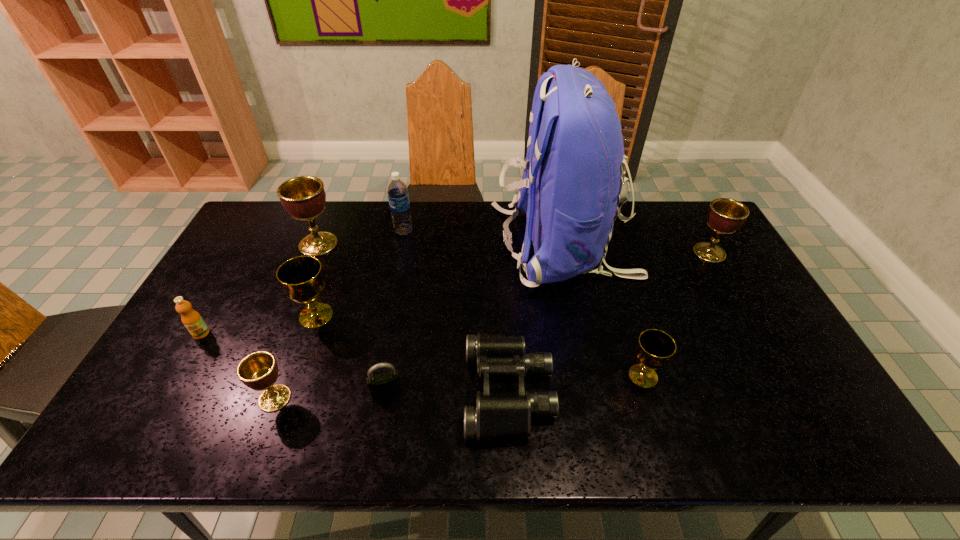
This screenshot has height=540, width=960. In order to click on chalice located in the far edge section of the desktop in this screenshot , I will do `click(303, 197)`.

You are a GUI agent. You are given a task and a screenshot of the screen. Output one action in this format:
    pyautogui.click(x=<x>, y=<y>)
    Task: Click on the object that is positioned at the near edge
    This screenshot has height=540, width=960.
    Given the screenshot: What is the action you would take?
    pyautogui.click(x=499, y=415)

At what (x,y) coordinates should I click in order to perform the action: click on object that is at the left edge. Please return your answer as a coordinate pair (x, y). The height and width of the screenshot is (540, 960). Looking at the image, I should click on (192, 320).

In order to click on object present at the right edge in this screenshot , I will do `click(725, 216)`.

In the image, there is a desktop. Where is `free space at the far edge`? The height and width of the screenshot is (540, 960). free space at the far edge is located at coordinates (468, 222).

I want to click on vacant region at the near edge of the desktop, so click(500, 445).

Identify the location of vacant space at the left edge of the desktop. This screenshot has width=960, height=540. (215, 301).

Identify the location of vacant area at the right edge of the desktop. (708, 262).

Identify the location of free space at the near left corner of the desktop. The height and width of the screenshot is (540, 960). (121, 421).

Where is `free space at the far right corner`? free space at the far right corner is located at coordinates point(685,201).